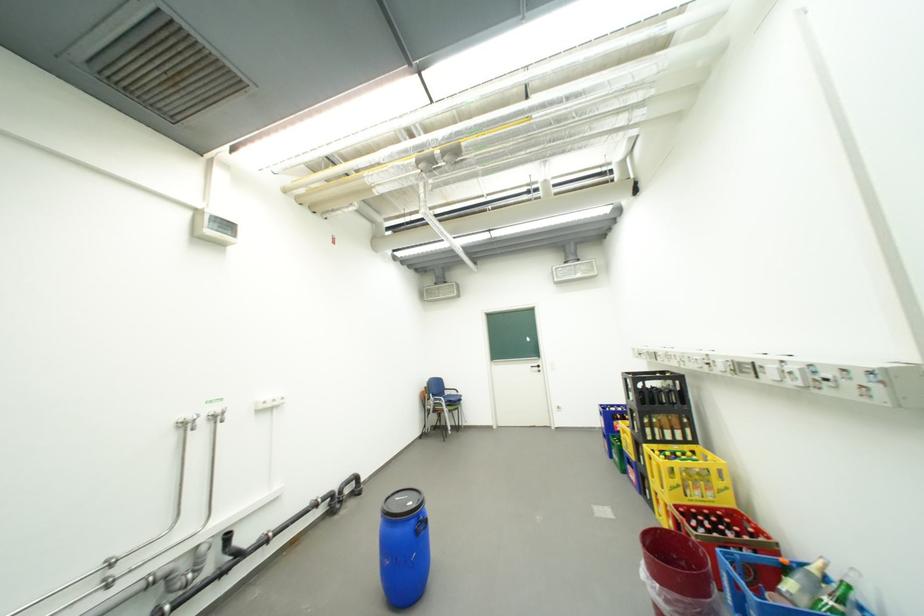
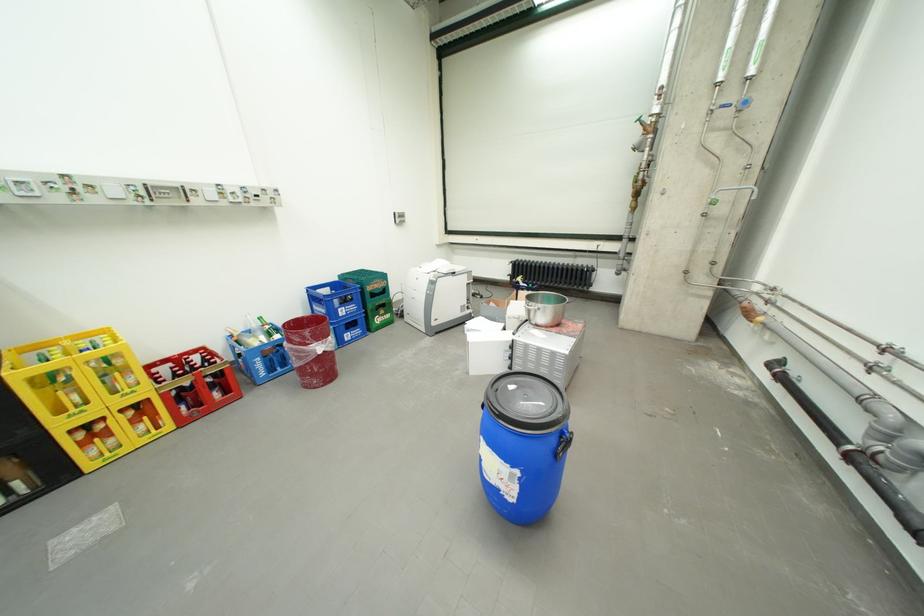
Find the pixel in the second image that matches point 655,448 in the first image.

(30, 374)